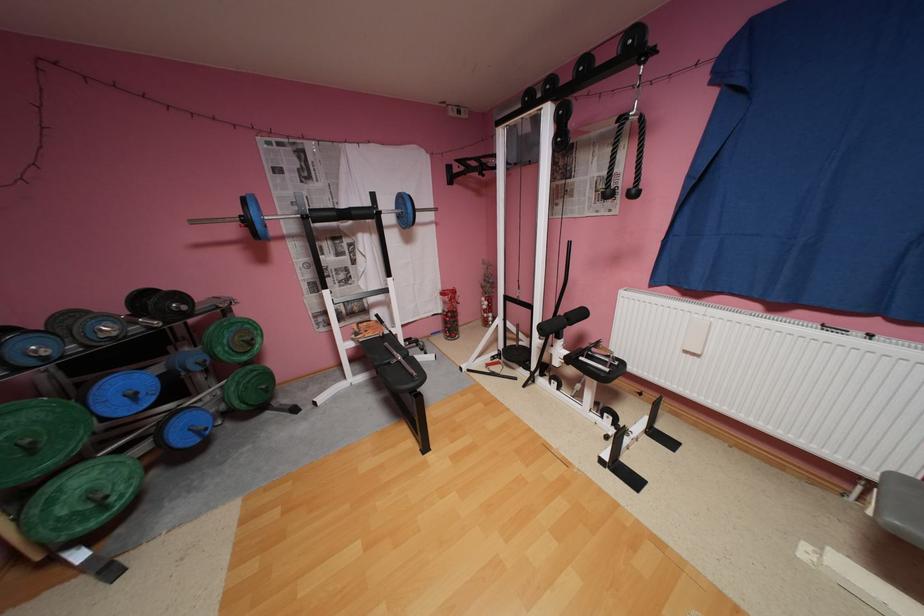
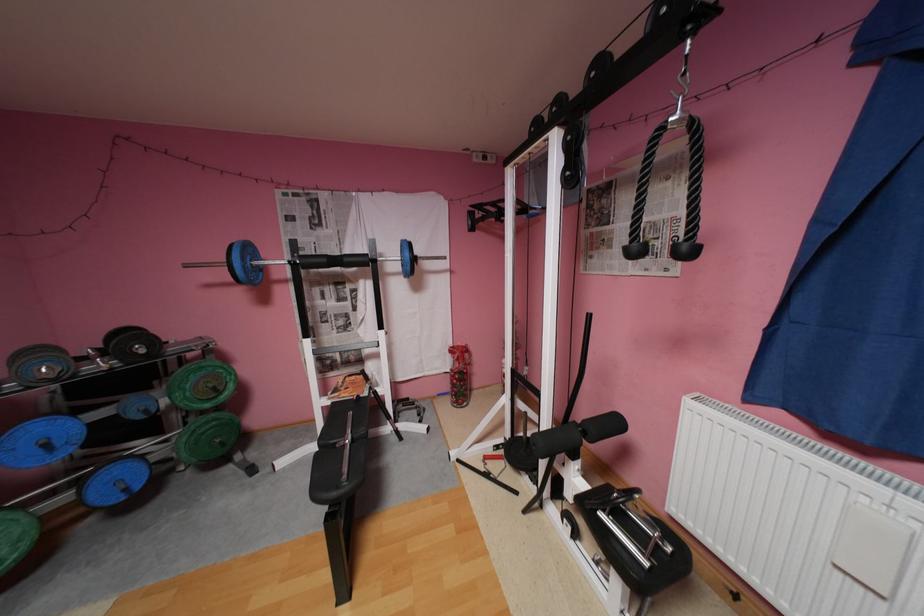
Find the pixel in the second image that matches point (362, 213) in the first image.

(355, 259)